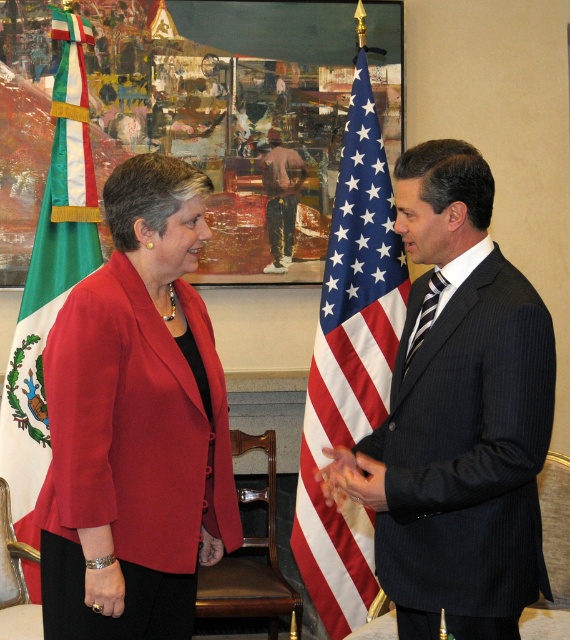
Can you confirm if matte red blazer at center is taller than dark blue pinstripe suit at center?

Yes.

Can you confirm if matte red blazer at center is positioned to the right of dark blue pinstripe suit at center?

No, matte red blazer at center is not to the right of dark blue pinstripe suit at center.

Is point (185, 477) less distant than point (481, 488)?

No.

I want to click on matte red blazer at center, so click(x=136, y=422).

What do you see at coordinates (349, 364) in the screenshot? The height and width of the screenshot is (640, 570). I see `american flag at center` at bounding box center [349, 364].

Does american flag at center appear on the left side of smooth skin hand at center?

No, american flag at center is not to the left of smooth skin hand at center.

Identify the location of american flag at center. The width and height of the screenshot is (570, 640). (349, 364).

Who is positioned more to the left, green and white fabric flag at left or pink cotton shirt at center?

green and white fabric flag at left

Which of these two, green and white fabric flag at left or pink cotton shirt at center, stands shorter?

pink cotton shirt at center is shorter.

The width and height of the screenshot is (570, 640). In order to click on green and white fabric flag at left in this screenshot , I will do `click(50, 273)`.

At what (x,y) coordinates should I click in order to perform the action: click on green and white fabric flag at left. Please return your answer as a coordinate pair (x, y). The height and width of the screenshot is (640, 570). Looking at the image, I should click on (50, 273).